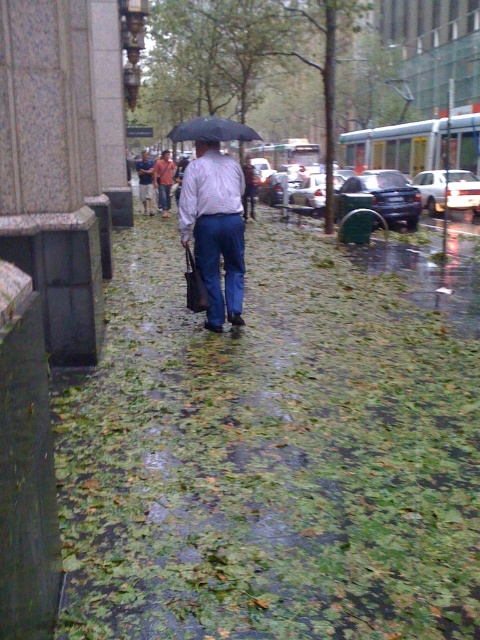
Based on the scene description, can you determine the spatial relationship between the matte white shirt at center and the denim pants at center?

The matte white shirt at center is below denim pants at center.

You are a pedestrian carrying a black matte umbrella at center and wearing denim pants at center during a rainy day. Can you walk through a doorway that is 1.8 meters tall without bending down?

The black matte umbrella at center is taller than the denim pants at center. Since the doorway is 1.8 meters tall, you should check the umbrella height. If the umbrella is taller than 1.8 meters, you need to lower it. However, the description only states it is taller than the pants, not the exact measurement. Without knowing the exact height of the umbrella, it is uncertain whether bending is required.

Based on the scene description, can you determine which object is shorter between the matte white shirt at center and the denim pants at center?

The matte white shirt at center is shorter than the denim pants at center.